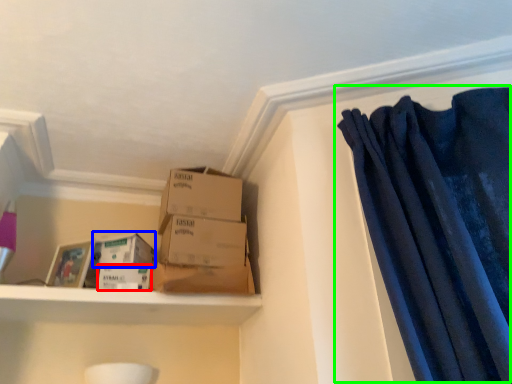
Question: Which is farther away from storage box (highlighted by a red box)? storage box (highlighted by a blue box) or curtain (highlighted by a green box)?

Choices:
 (A) storage box
 (B) curtain

Answer: (B)